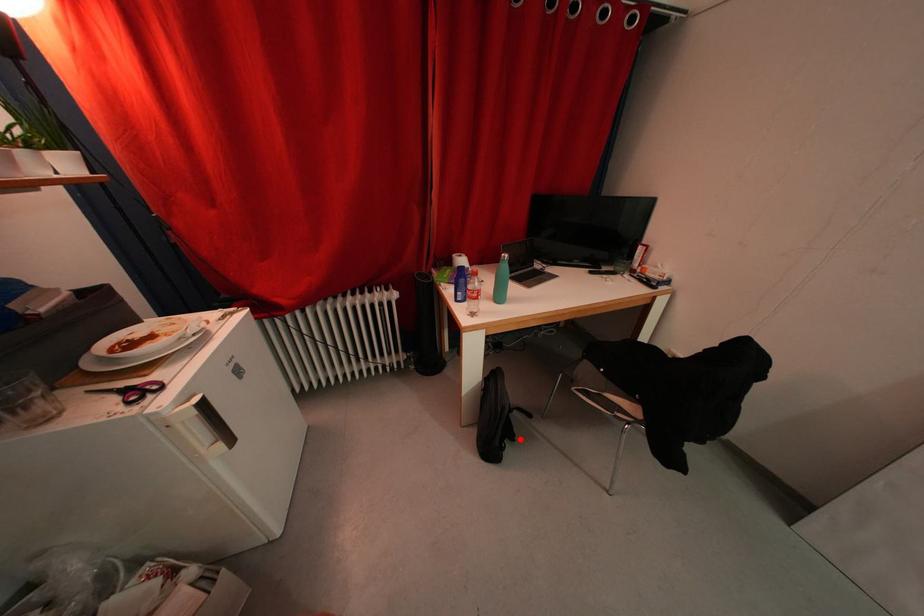
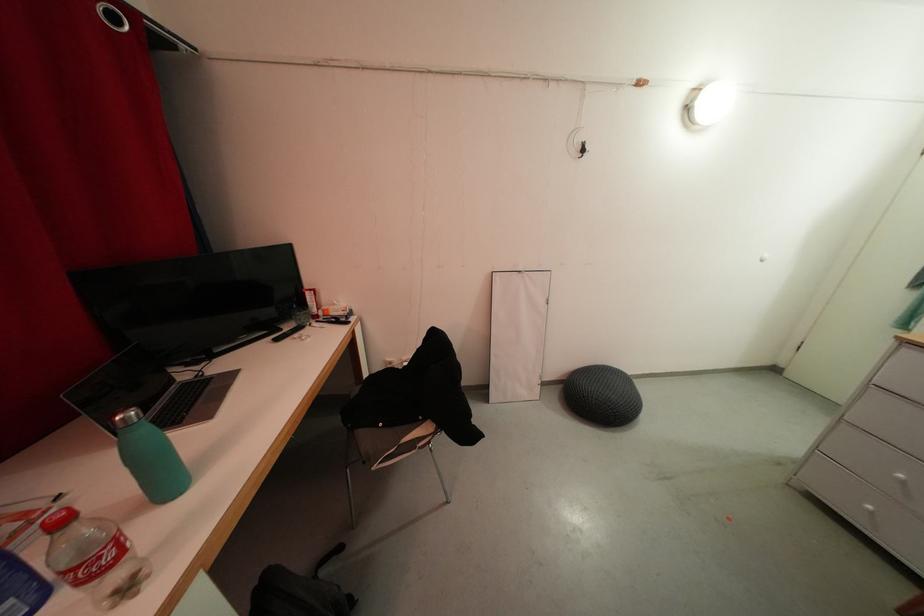
Question: I am providing you with two images of the same scene from different viewpoints. In image1, a red point is highlighted. Considering the same 3D point in image2, which of the following is correct?

Choices:
 (A) It is closer
 (B) It is farther

Answer: (A)